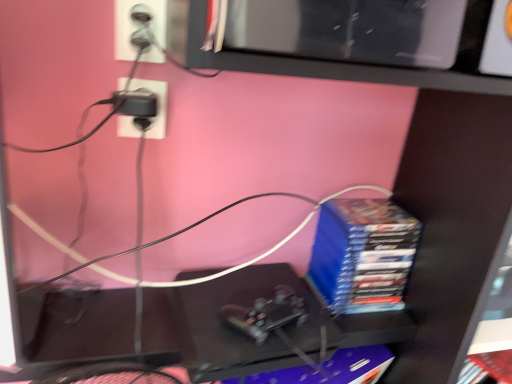
Question: From a real-world perspective, is blue matte stack of books at right, which ranks as the 1th paperback book in top-to-bottom order, physically below purple matte paperback book at center, the 1th paperback book when ordered from bottom to top?

Choices:
 (A) yes
 (B) no

Answer: (B)

Question: Considering the relative sizes of blue matte stack of books at right, which ranks as the 1th paperback book in top-to-bottom order, and purple matte paperback book at center, which is the second paperback book from top to bottom, in the image provided, is blue matte stack of books at right, which ranks as the 1th paperback book in top-to-bottom order, thinner than purple matte paperback book at center, which is the second paperback book from top to bottom,?

Choices:
 (A) yes
 (B) no

Answer: (B)

Question: Would you say blue matte stack of books at right, which ranks as the 1th paperback book in top-to-bottom order, contains purple matte paperback book at center, the 1th paperback book when ordered from bottom to top?

Choices:
 (A) no
 (B) yes

Answer: (A)

Question: Is blue matte stack of books at right, which ranks as the 1th paperback book in top-to-bottom order, oriented towards purple matte paperback book at center, the 1th paperback book when ordered from bottom to top?

Choices:
 (A) yes
 (B) no

Answer: (B)

Question: Is blue matte stack of books at right, the second paperback book positioned from the bottom, facing away from purple matte paperback book at center, which is the second paperback book from top to bottom?

Choices:
 (A) yes
 (B) no

Answer: (B)

Question: Is blue matte stack of books at right, the second paperback book positioned from the bottom, not near purple matte paperback book at center, which is the second paperback book from top to bottom?

Choices:
 (A) no
 (B) yes

Answer: (A)

Question: From a real-world perspective, is purple matte paperback book at center, the 1th paperback book when ordered from bottom to top, on top of blue matte stack of books at right, which ranks as the 1th paperback book in top-to-bottom order?

Choices:
 (A) no
 (B) yes

Answer: (A)

Question: Is purple matte paperback book at center, which is the second paperback book from top to bottom, far from blue matte stack of books at right, the second paperback book positioned from the bottom?

Choices:
 (A) no
 (B) yes

Answer: (A)

Question: Can you confirm if purple matte paperback book at center, the 1th paperback book when ordered from bottom to top, is bigger than blue matte stack of books at right, the second paperback book positioned from the bottom?

Choices:
 (A) no
 (B) yes

Answer: (A)

Question: Does purple matte paperback book at center, which is the second paperback book from top to bottom, come behind blue matte stack of books at right, which ranks as the 1th paperback book in top-to-bottom order?

Choices:
 (A) no
 (B) yes

Answer: (A)

Question: Does purple matte paperback book at center, the 1th paperback book when ordered from bottom to top, have a lesser width compared to blue matte stack of books at right, the second paperback book positioned from the bottom?

Choices:
 (A) yes
 (B) no

Answer: (A)

Question: Is the position of purple matte paperback book at center, the 1th paperback book when ordered from bottom to top, less distant than that of blue matte stack of books at right, the second paperback book positioned from the bottom?

Choices:
 (A) yes
 (B) no

Answer: (A)

Question: Is purple matte paperback book at center, the 1th paperback book when ordered from bottom to top, spatially inside blue matte stack of books at right, the second paperback book positioned from the bottom, or outside of it?

Choices:
 (A) inside
 (B) outside

Answer: (B)